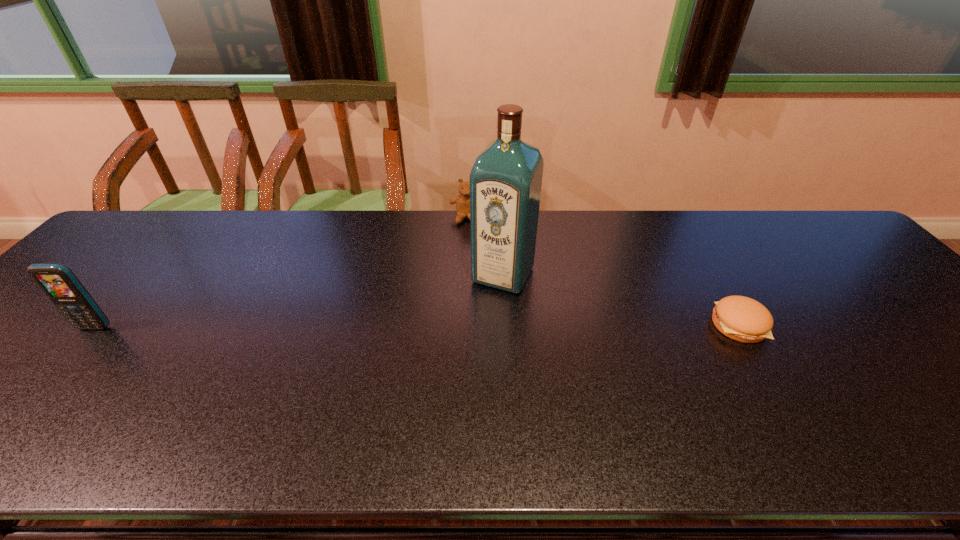
The height and width of the screenshot is (540, 960). I want to click on cellular telephone, so click(58, 282).

What are the coordinates of `the leftmost object` in the screenshot? It's located at (58, 282).

Where is `the shortest object`? the shortest object is located at coordinates [743, 319].

Image resolution: width=960 pixels, height=540 pixels. Find the location of `the rightmost object`. the rightmost object is located at coordinates (743, 319).

This screenshot has width=960, height=540. Identify the location of the second farthest object. (505, 181).

The image size is (960, 540). Identify the location of the tallest object. (505, 181).

Identify the location of the third tallest object. (462, 201).

This screenshot has height=540, width=960. I want to click on teddy bear, so click(x=462, y=201).

At what (x,y) coordinates should I click in order to perform the action: click on blank space located 0.180m on the screen of the leftmost object. Please return your answer as a coordinate pair (x, y). The image size is (960, 540). Looking at the image, I should click on (34, 396).

I want to click on vacant region located 0.150m on the left of the rightmost object, so click(x=651, y=325).